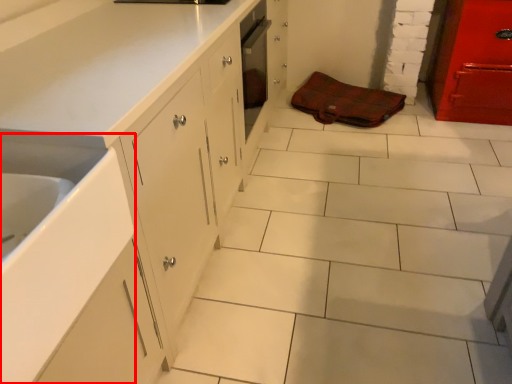
Question: From the image's perspective, where is sink (annotated by the red box) located relative to material?

Choices:
 (A) above
 (B) below

Answer: (B)